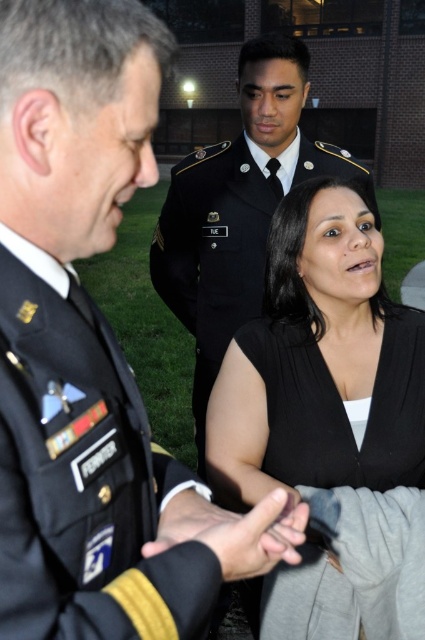
Question: Where is dark green uniform at center located in relation to black matte dress at center in the image?

Choices:
 (A) below
 (B) above

Answer: (B)

Question: Among these points, which one is farthest from the camera?

Choices:
 (A) (149, 577)
 (B) (178, 168)

Answer: (B)

Question: Can you confirm if dark blue fabric military uniform at center is positioned to the left of dark green military uniform at center?

Choices:
 (A) yes
 (B) no

Answer: (A)

Question: Among these points, which one is farthest from the camera?

Choices:
 (A) (235, 554)
 (B) (204, 177)

Answer: (B)

Question: Can you confirm if black matte dress at center is thinner than matte black hand at center?

Choices:
 (A) no
 (B) yes

Answer: (A)

Question: Which of the following is the farthest from the observer?

Choices:
 (A) (181, 532)
 (B) (257, 301)
 (C) (294, 289)
 (D) (277, 500)

Answer: (B)